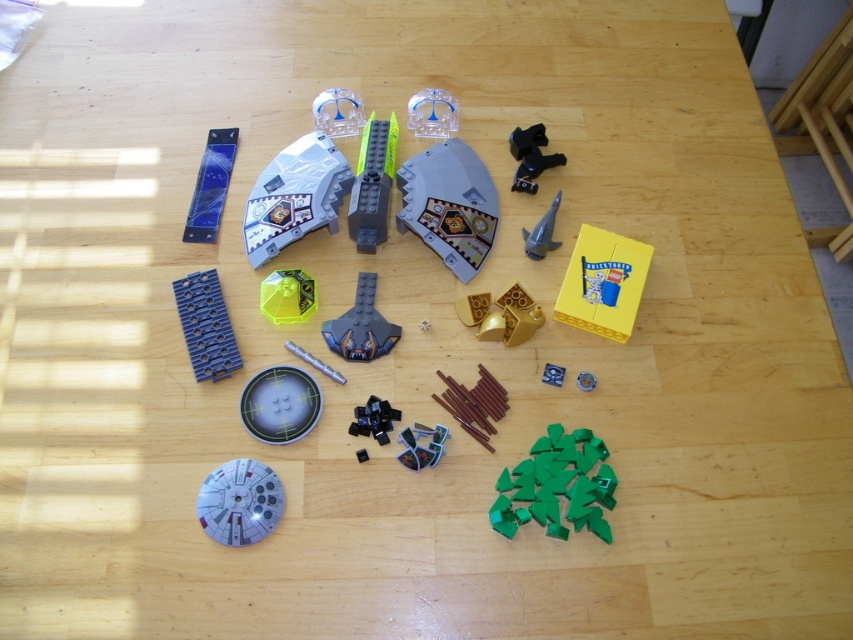
You are trying to build a LEGO model and need to place the green plastic triangles at lower right and the transparent plastic rectangular block at upper left. According to the image, which of these two LEGO pieces is closer to you?

The green plastic triangles at lower right is closer to you because it is in front of the transparent plastic rectangular block at upper left.

In the scene shown: You are trying to organize the LEGO pieces on the table. You see the yellow matte box at center right and the black plastic figure at upper right. Which of these two LEGO pieces is positioned more to the right side of the table?

The yellow matte box at center right is positioned more to the right side of the table compared to the black plastic figure at upper right.